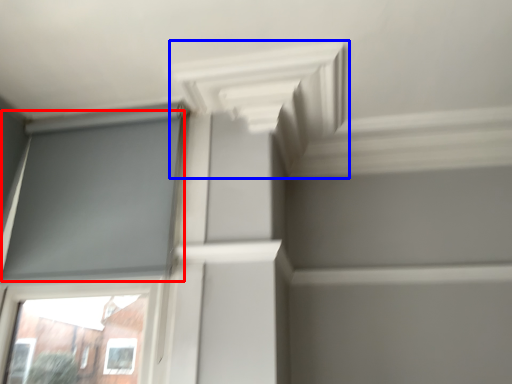
Question: Among these objects, which one is nearest to the camera, window screen (highlighted by a red box) or exhaust hood (highlighted by a blue box)?

Choices:
 (A) window screen
 (B) exhaust hood

Answer: (B)